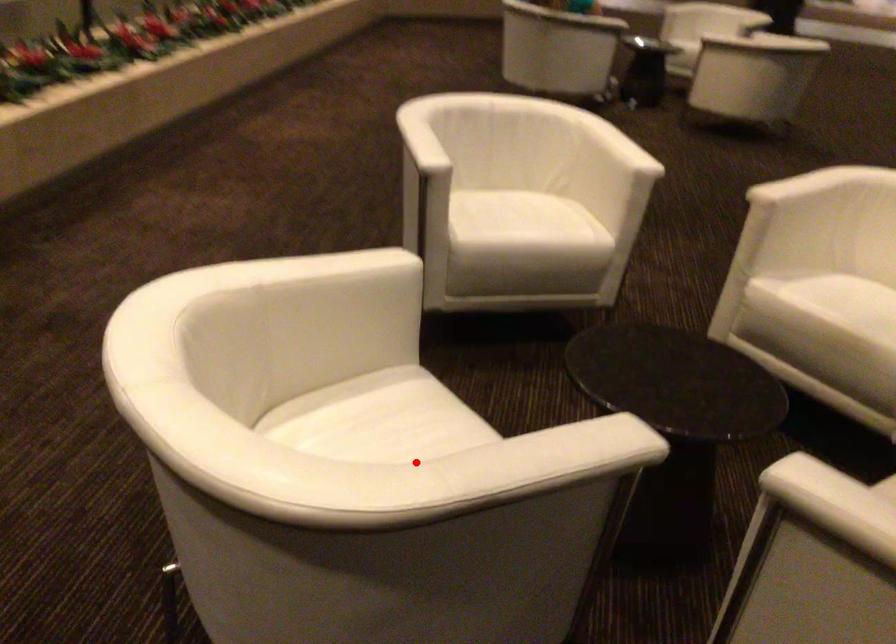
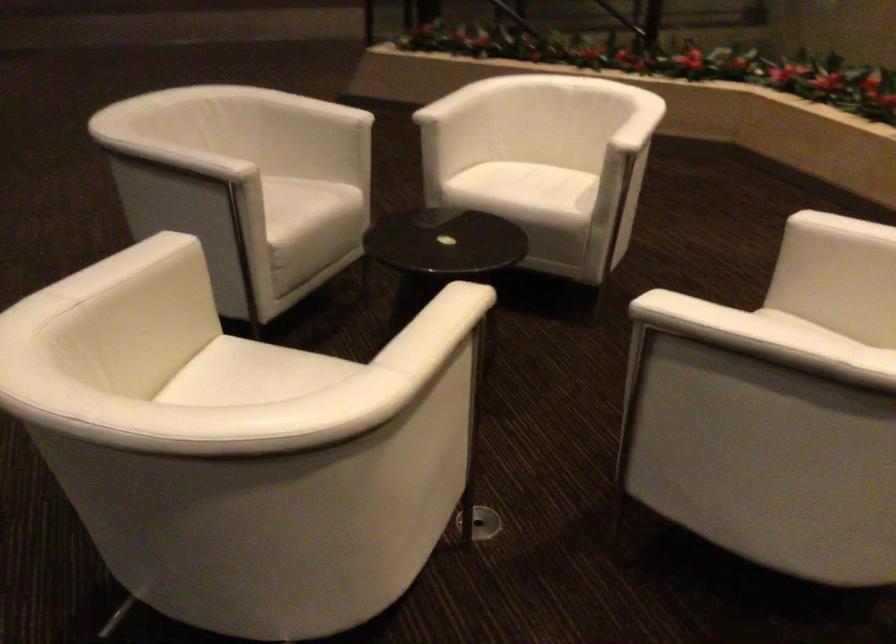
Where in the second image is the point corresponding to the highlighted location from the first image?

(469, 89)